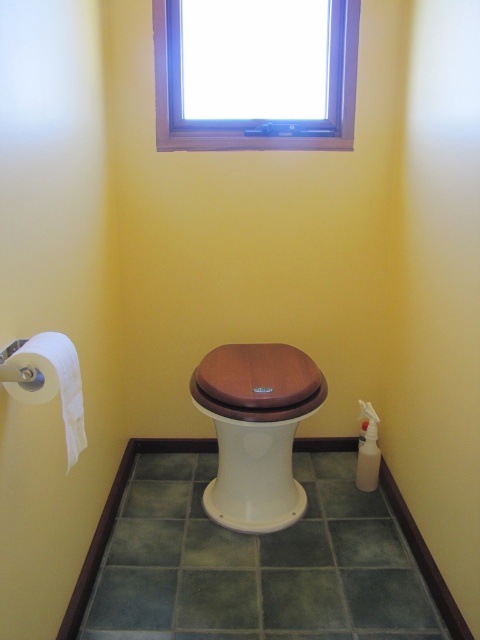
You are a cleaning robot with a width of 22 inches. You need to move from the wooden toilet lid at center to the white paper at left. Can you fit through the space between them?

The wooden toilet lid at center is 27.40 inches away from the white paper at left. Since the robot is 22 inches wide, there is enough space for it to move through the 27.40 inches gap.